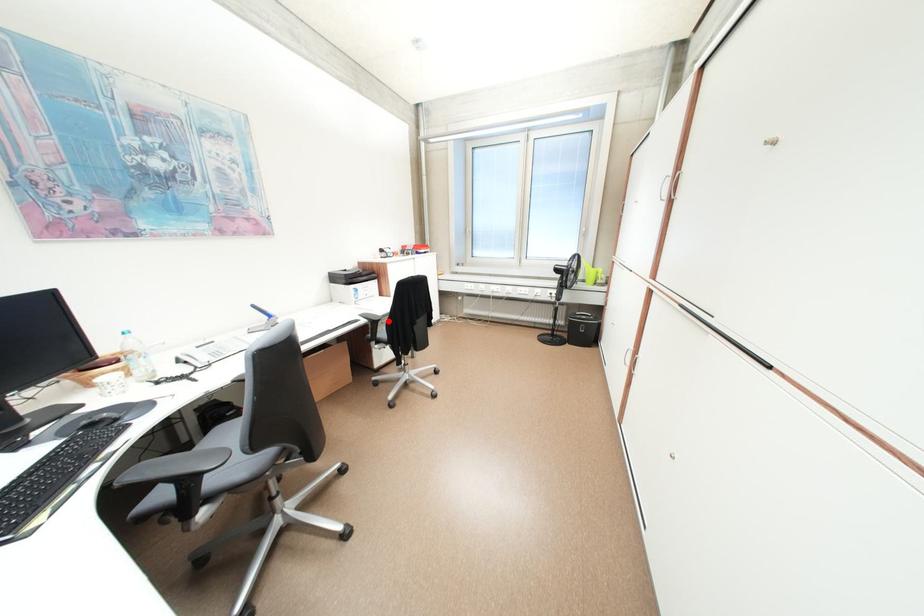
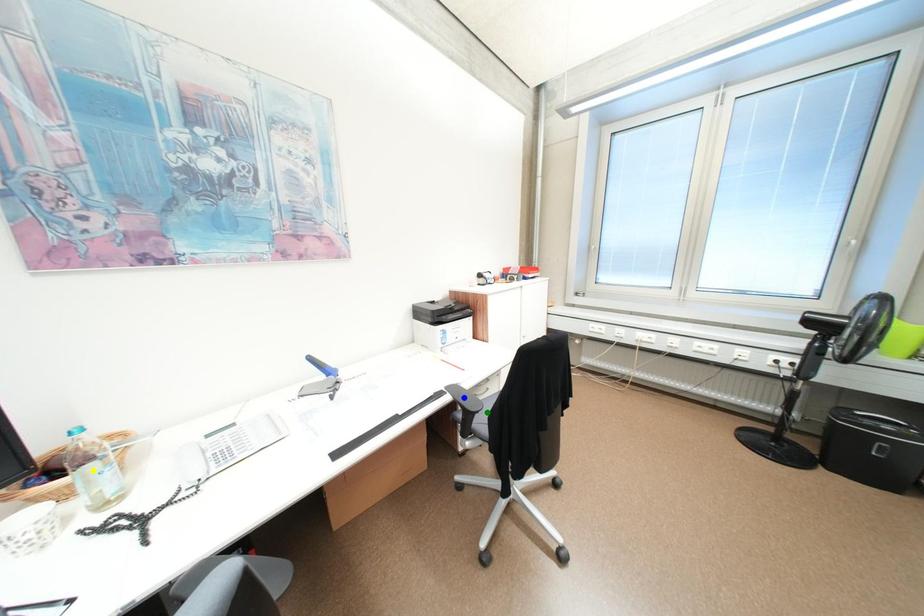
Question: I am providing you with two images of the same scene from different viewpoints. A red point is marked on the first image. You are given multiple points on the second image. Which point in image 2 represents the same 3d spot as the red point in image 1?

Choices:
 (A) blue point
 (B) yellow point
 (C) green point

Answer: (C)